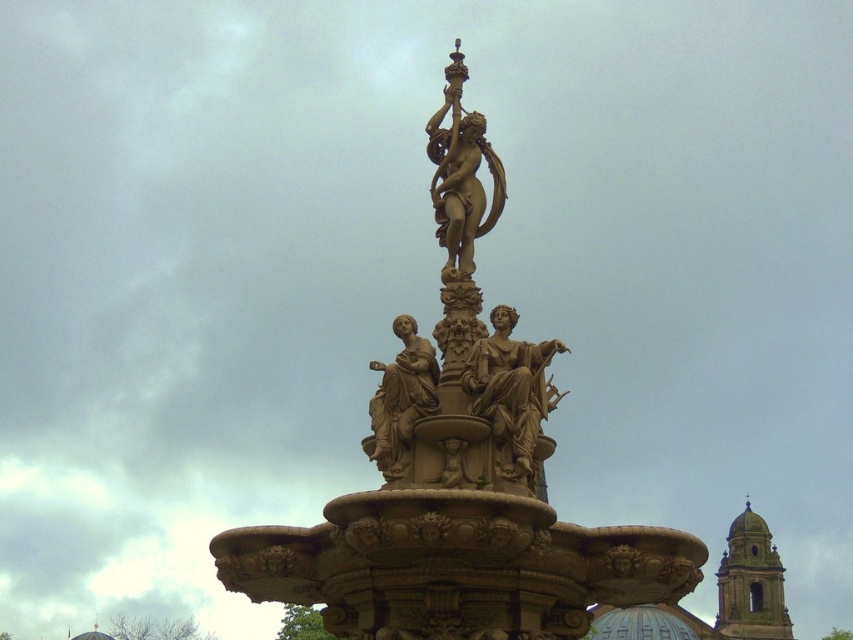
How much distance is there between bronze statue at center and gold polished statue at center?

A distance of 9.01 feet exists between bronze statue at center and gold polished statue at center.

Image resolution: width=853 pixels, height=640 pixels. Find the location of `bronze statue at center`. bronze statue at center is located at coordinates (509, 392).

Is point (550, 397) positioned behind point (474, 177)?

That is False.

Find the location of a particular element. bronze statue at center is located at coordinates (509, 392).

Is brown stone fountain at center wider than gold polished statue at center?

Yes.

How much distance is there between brown stone fountain at center and gold polished statue at center?

brown stone fountain at center is 6.58 meters away from gold polished statue at center.

Between point (358, 600) and point (437, 186), which one is positioned in front?

Point (358, 600) is in front.

Identify the location of brown stone fountain at center. (463, 480).

Can you confirm if brown stone fountain at center is shorter than matte bronze statue at center?

In fact, brown stone fountain at center may be taller than matte bronze statue at center.

This screenshot has height=640, width=853. Find the location of `brown stone fountain at center`. brown stone fountain at center is located at coordinates (463, 480).